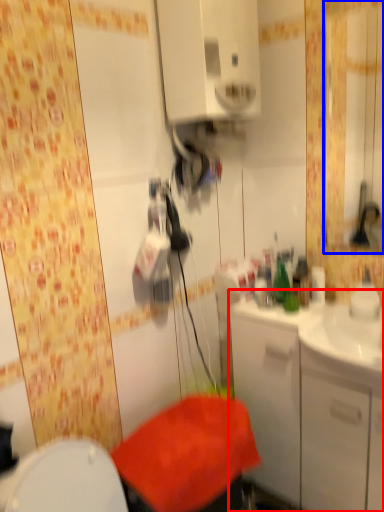
Question: Among these objects, which one is farthest to the camera, bathroom cabinet (highlighted by a red box) or mirror (highlighted by a blue box)?

Choices:
 (A) bathroom cabinet
 (B) mirror

Answer: (B)